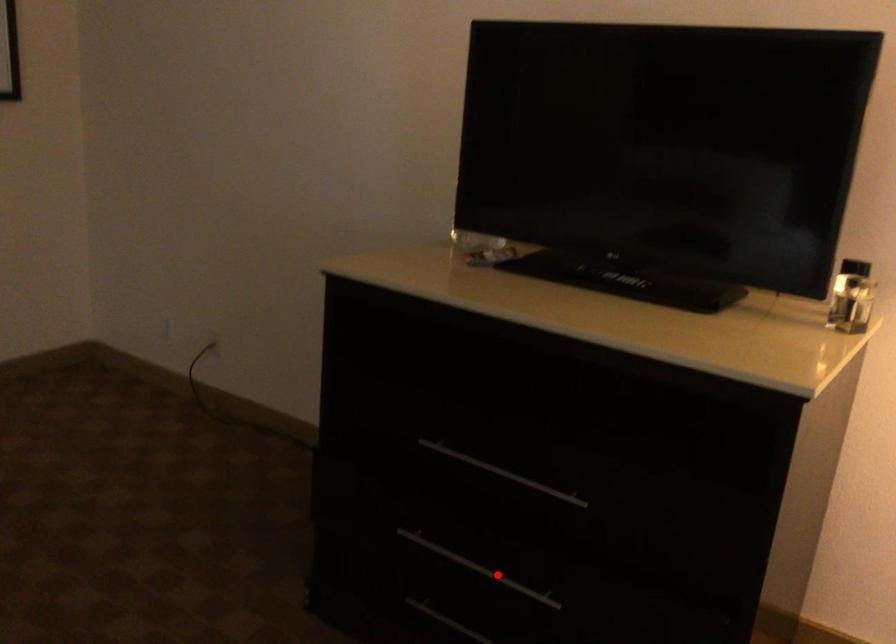
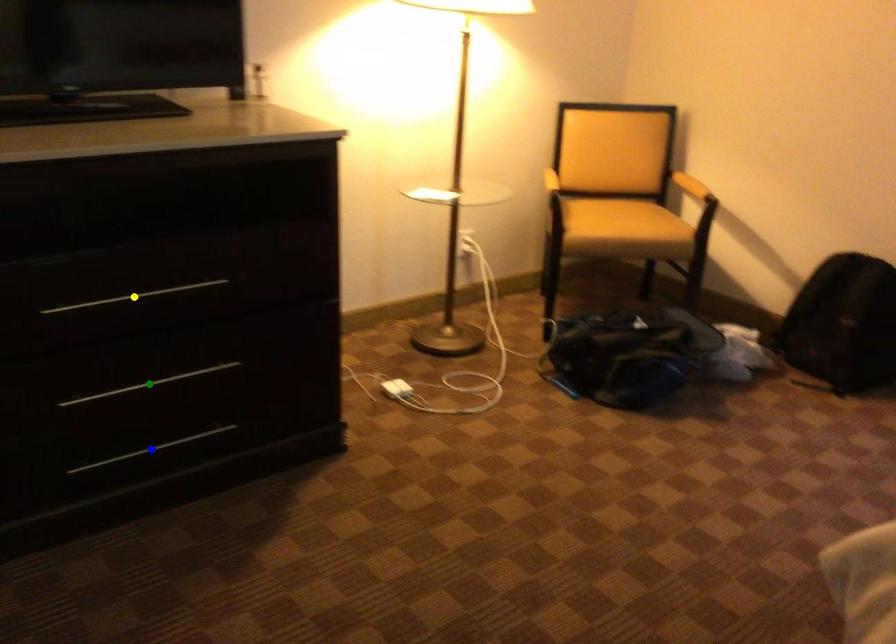
Question: I am providing you with two images of the same scene from different viewpoints. A red point is marked on the first image. You are given multiple points on the second image. Which point in image 2 is actually the same real-world point as the red point in image 1?

Choices:
 (A) blue point
 (B) yellow point
 (C) green point

Answer: (C)